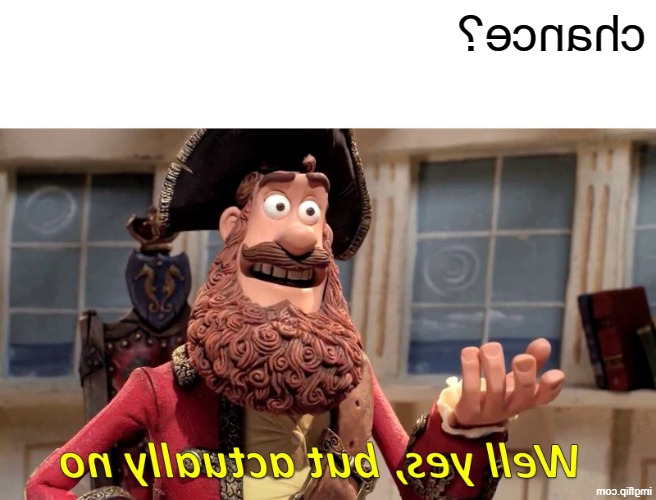
Locate an element on the screen. windown in background is located at coordinates (492, 248), (73, 243).